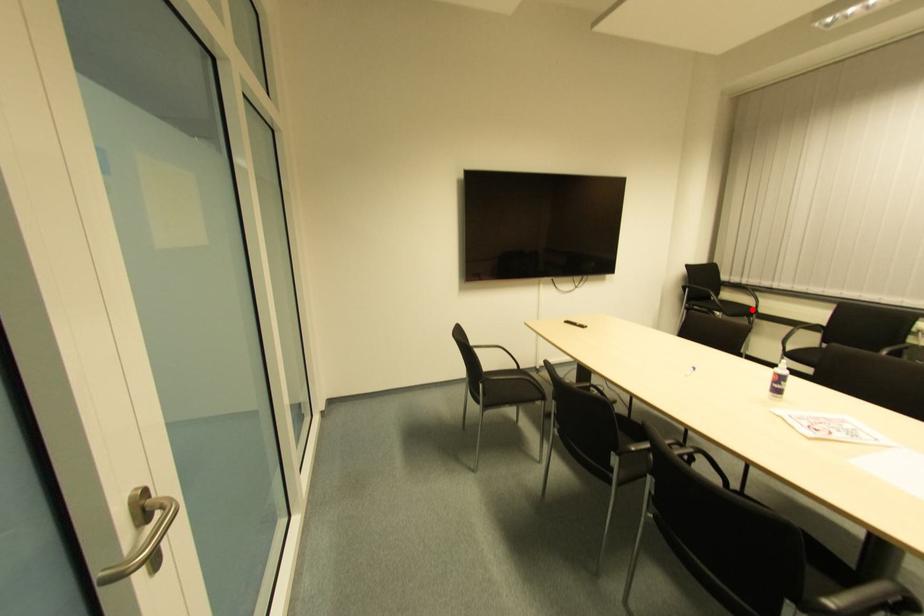
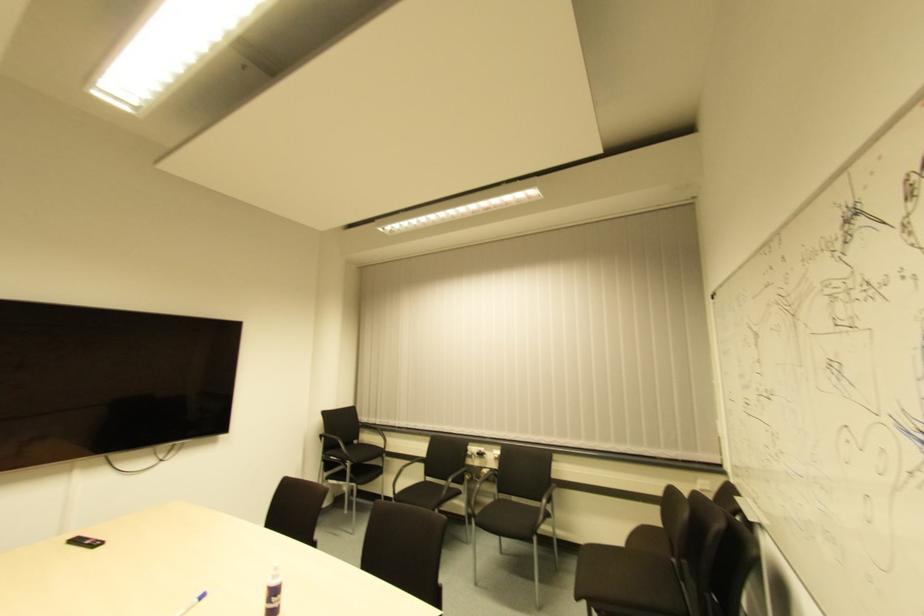
Question: I am providing you with two images of the same scene from different viewpoints. Image1 has a red point marked. In image2, the corresponding 3D location appears at what relative position? Reply with the corresponding letter.

Choices:
 (A) Closer
 (B) Farther

Answer: (B)